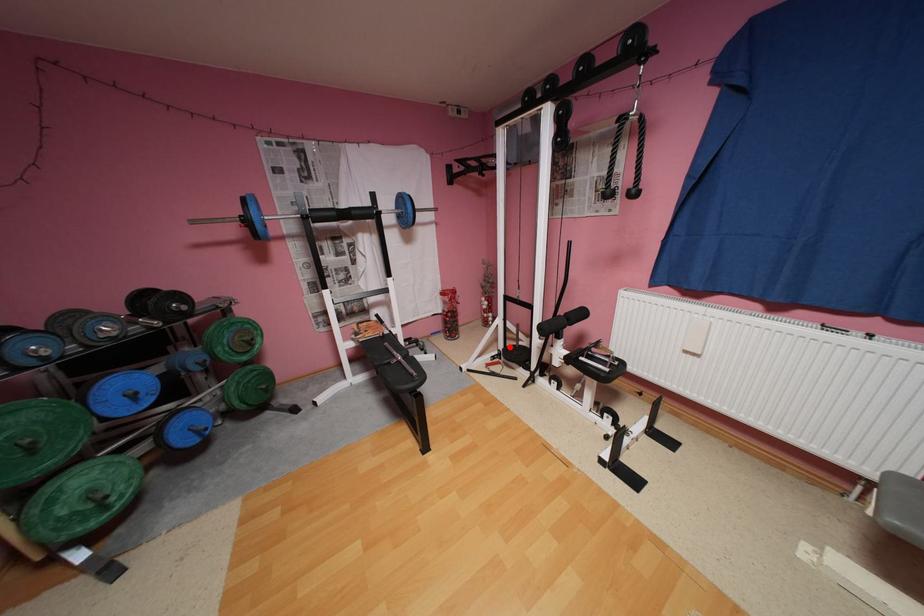
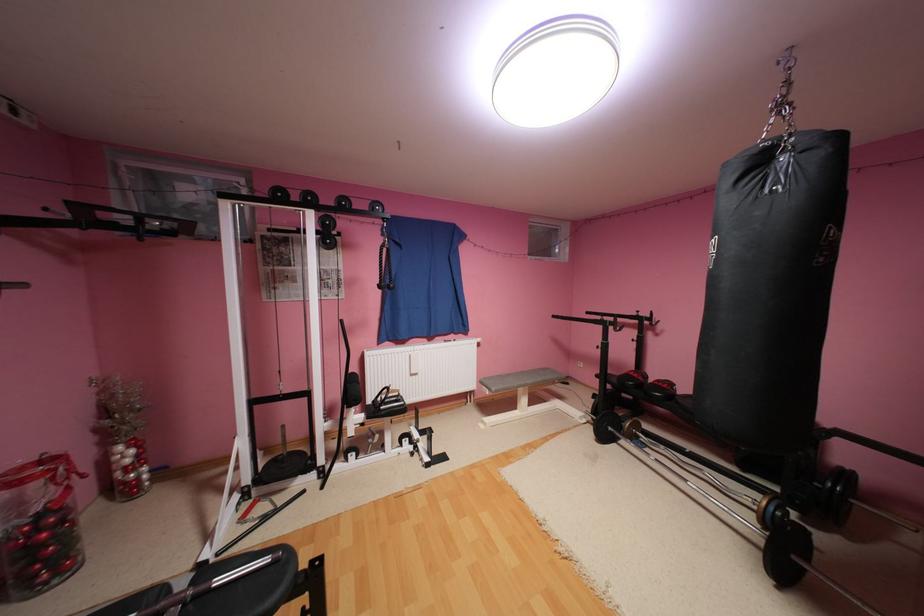
In the second image, find the point that corresponds to the highlighted location in the first image.

(256, 479)